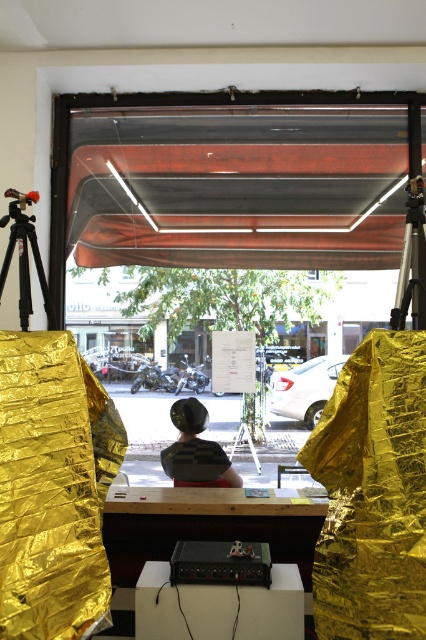
You are setting up a photography studio and need to place a large equipment box that requires a surface wider than the matte black tripod at left. Is the white matte table at center suitable for this purpose?

The white matte table at center has a width larger than the matte black tripod at left, so it is suitable for placing the large equipment box that requires a surface wider than the matte black tripod at left.